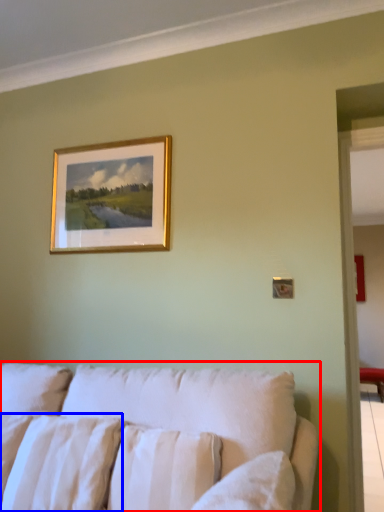
Question: Which object is closer to the camera taking this photo, studio couch (highlighted by a red box) or pillow (highlighted by a blue box)?

Choices:
 (A) studio couch
 (B) pillow

Answer: (A)